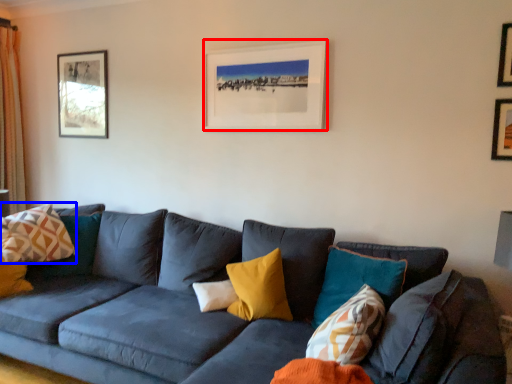
Question: Among these objects, which one is farthest to the camera, picture frame (highlighted by a red box) or pillow (highlighted by a blue box)?

Choices:
 (A) picture frame
 (B) pillow

Answer: (B)